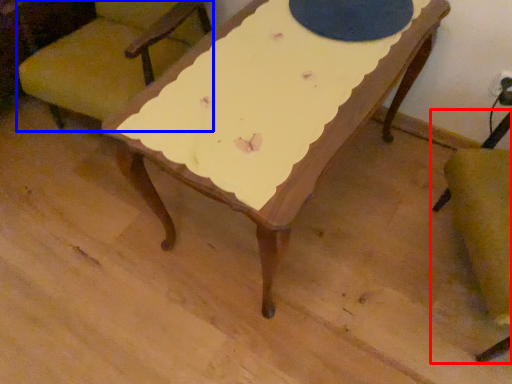
Question: Which object appears farthest to the camera in this image, chair (highlighted by a red box) or chair (highlighted by a blue box)?

Choices:
 (A) chair
 (B) chair

Answer: (B)